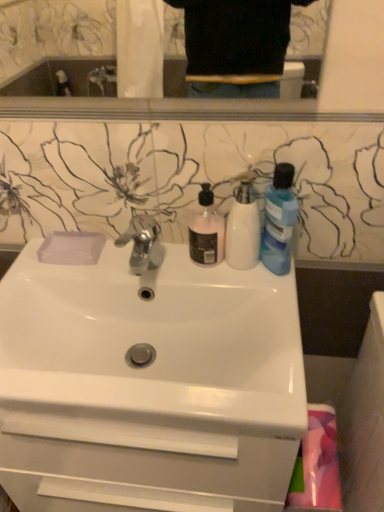
I want to click on free space to the left of blue translucent bottle at upper right, which is counted as the first cleaning product, starting from the right, so click(x=203, y=272).